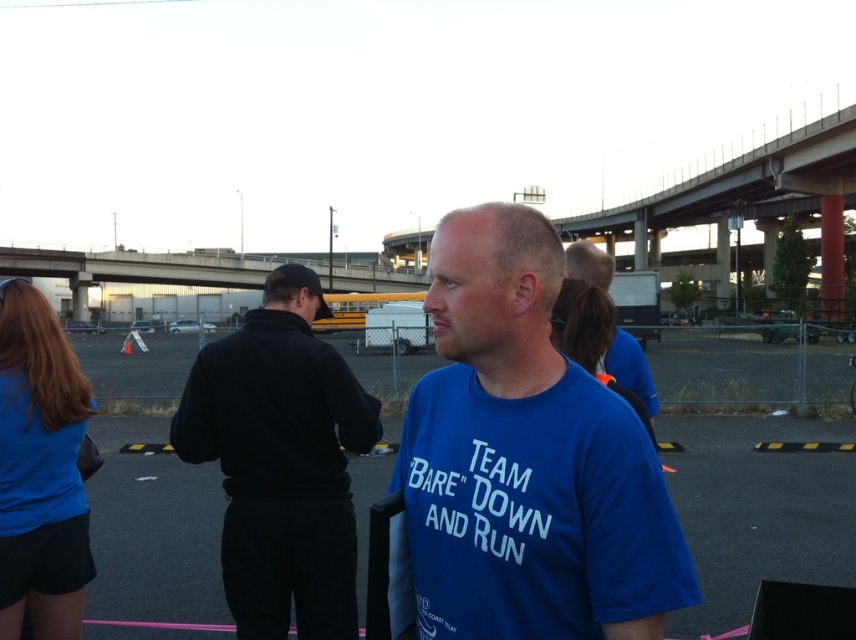
You are standing at the point closer to the camera between the two points, point (55, 496) and point (599, 365). Which point are you standing at?

You are standing at point (55, 496) because it is closer to the camera than point (599, 365).